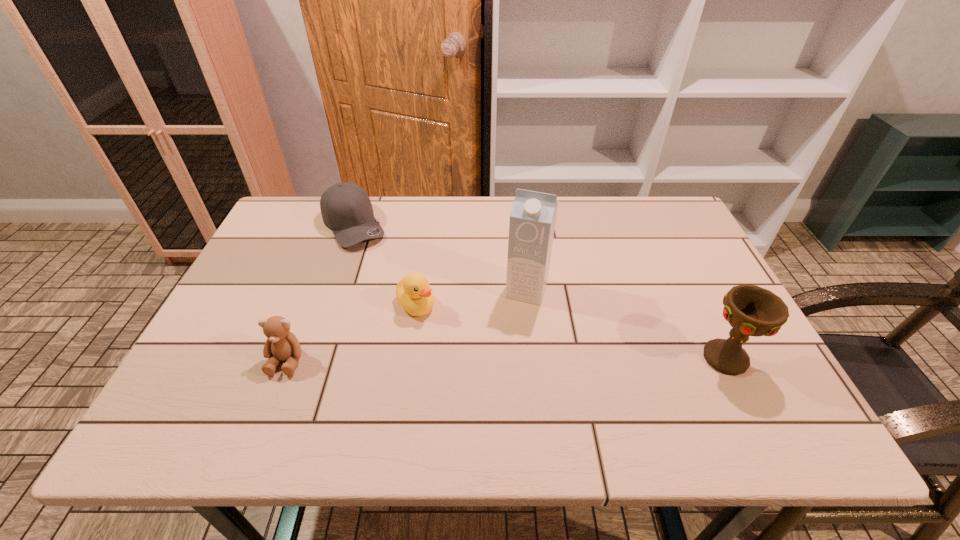
Locate an element on the screen. The image size is (960, 540). object positioned at the left edge is located at coordinates (346, 209).

Where is `object that is positioned at the right edge`? This screenshot has width=960, height=540. object that is positioned at the right edge is located at coordinates (751, 310).

You are a GUI agent. You are given a task and a screenshot of the screen. Output one action in this format:
    pyautogui.click(x=<x>, y=<y>)
    Task: Click on the object positioned at the far left corner
    Image resolution: width=960 pixels, height=540 pixels.
    Given the screenshot: What is the action you would take?
    pyautogui.click(x=346, y=209)

This screenshot has width=960, height=540. Identify the location of object situated at the near right corner. (751, 310).

The height and width of the screenshot is (540, 960). Identify the location of vacant area at the far edge of the desktop. (404, 205).

You are a GUI agent. You are given a task and a screenshot of the screen. Output one action in this format:
    pyautogui.click(x=<x>, y=<y>)
    Task: Click on the vacant space at the near edge
    The image size is (960, 540).
    Given the screenshot: What is the action you would take?
    pyautogui.click(x=343, y=380)

This screenshot has height=540, width=960. Identify the location of vacant space at the left edge. (293, 244).

Locate an element on the screen. Image resolution: width=960 pixels, height=540 pixels. free spot at the right edge of the desktop is located at coordinates (723, 331).

The width and height of the screenshot is (960, 540). In order to click on blank space at the near left corner of the desktop in this screenshot , I will do `click(230, 399)`.

What are the coordinates of `vacant space at the far right corner of the desktop` in the screenshot? It's located at (649, 204).